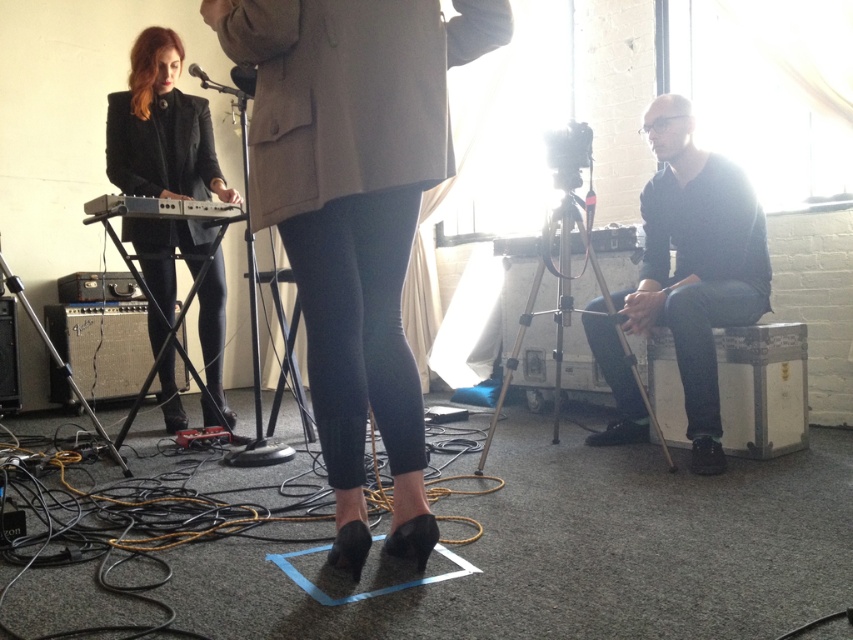
Question: Which point is closer to the camera taking this photo?

Choices:
 (A) (112, 198)
 (B) (358, 67)
 (C) (668, 156)
 (D) (202, 77)

Answer: (B)

Question: Among these objects, which one is farthest from the camera?

Choices:
 (A) matte black keyboard at left
 (B) matte black shoes at center
 (C) metallic silver microphone at upper center
 (D) dark gray sweater at right

Answer: (C)

Question: Can you confirm if matte black jacket at left is bigger than metallic silver microphone at upper center?

Choices:
 (A) yes
 (B) no

Answer: (A)

Question: Does matte black jacket at left come behind metallic silver microphone at upper center?

Choices:
 (A) yes
 (B) no

Answer: (A)

Question: Can you confirm if matte black shoes at center is wider than matte black keyboard at left?

Choices:
 (A) yes
 (B) no

Answer: (A)

Question: Among these points, which one is nearest to the camera?

Choices:
 (A) (705, 154)
 (B) (303, 77)
 (C) (117, 198)

Answer: (B)